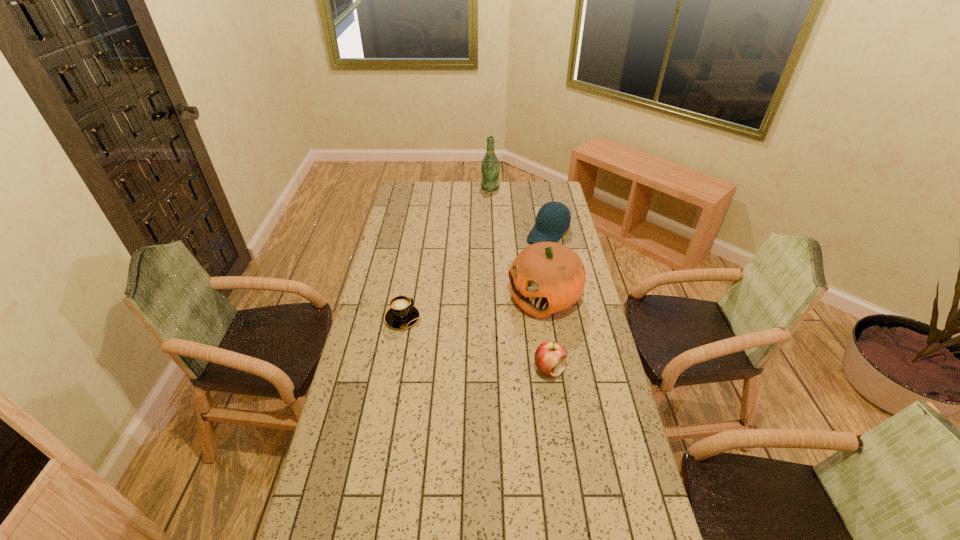
Identify the location of the leftmost object. (402, 314).

You are a GUI agent. You are given a task and a screenshot of the screen. Output one action in this format:
    pyautogui.click(x=<x>, y=<y>)
    Task: Click on the shortest object
    
    Given the screenshot: What is the action you would take?
    pyautogui.click(x=402, y=314)

Where is `apple`? apple is located at coordinates (550, 357).

Image resolution: width=960 pixels, height=540 pixels. Find the location of `the second shortest object`. the second shortest object is located at coordinates (550, 357).

Locate an element on the screen. Image resolution: width=960 pixels, height=540 pixels. the second tallest object is located at coordinates tap(546, 277).

The image size is (960, 540). Identify the location of the tallest object. (490, 168).

The height and width of the screenshot is (540, 960). Identify the location of the farthest object. (490, 168).

Locate an element on the screen. the fourth nearest object is located at coordinates (553, 219).

At what (x,y) coordinates should I click in order to perform the action: click on the third tallest object. Please return your answer as a coordinate pair (x, y). Image resolution: width=960 pixels, height=540 pixels. Looking at the image, I should click on (553, 219).

Where is `vacant space located 0.320m on the front of the leftmost object`? vacant space located 0.320m on the front of the leftmost object is located at coordinates (388, 404).